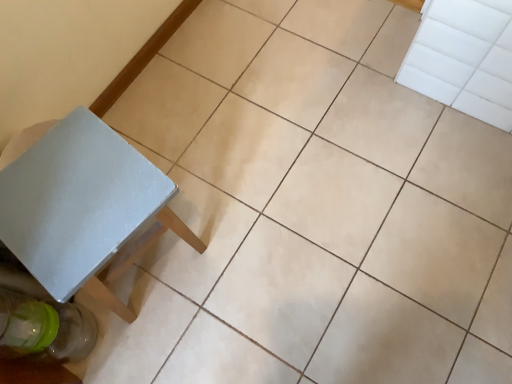
You are a GUI agent. You are given a task and a screenshot of the screen. Output one action in this format:
    pyautogui.click(x=<x>, y=<y>)
    Task: Click on the vacant area that lies in front of white matte table at lower left
    
    Given the screenshot: What is the action you would take?
    pyautogui.click(x=160, y=341)